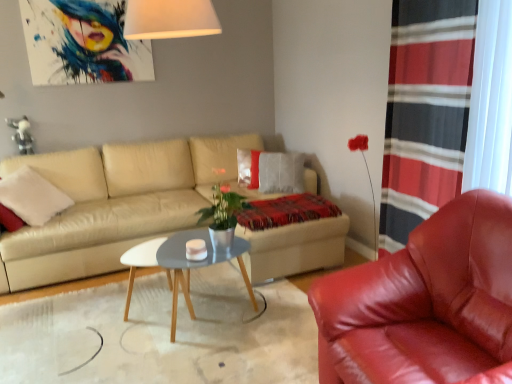
Question: Is gray wooden coffee table at center thinner than red striped curtain at right?

Choices:
 (A) no
 (B) yes

Answer: (A)

Question: From a real-world perspective, is gray wooden coffee table at center physically below red striped curtain at right?

Choices:
 (A) yes
 (B) no

Answer: (A)

Question: Is gray wooden coffee table at center aimed at red striped curtain at right?

Choices:
 (A) no
 (B) yes

Answer: (A)

Question: Is gray wooden coffee table at center next to red striped curtain at right and touching it?

Choices:
 (A) no
 (B) yes

Answer: (A)

Question: Does gray wooden coffee table at center appear on the left side of red striped curtain at right?

Choices:
 (A) no
 (B) yes

Answer: (B)

Question: Is gray wooden coffee table at center oriented away from red striped curtain at right?

Choices:
 (A) no
 (B) yes

Answer: (A)

Question: From a real-world perspective, is shiny red leather armchair at right physically above plaid woolen blanket at center?

Choices:
 (A) yes
 (B) no

Answer: (B)

Question: Is shiny red leather armchair at right taller than plaid woolen blanket at center?

Choices:
 (A) yes
 (B) no

Answer: (A)

Question: Does shiny red leather armchair at right have a lesser height compared to plaid woolen blanket at center?

Choices:
 (A) yes
 (B) no

Answer: (B)

Question: From the image's perspective, is shiny red leather armchair at right under plaid woolen blanket at center?

Choices:
 (A) yes
 (B) no

Answer: (A)

Question: Considering the relative positions of shiny red leather armchair at right and plaid woolen blanket at center in the image provided, is shiny red leather armchair at right to the right of plaid woolen blanket at center from the viewer's perspective?

Choices:
 (A) no
 (B) yes

Answer: (B)

Question: Is the position of shiny red leather armchair at right more distant than that of plaid woolen blanket at center?

Choices:
 (A) yes
 (B) no

Answer: (B)

Question: Is shiny red leather armchair at right bigger than gray wooden coffee table at center?

Choices:
 (A) no
 (B) yes

Answer: (B)